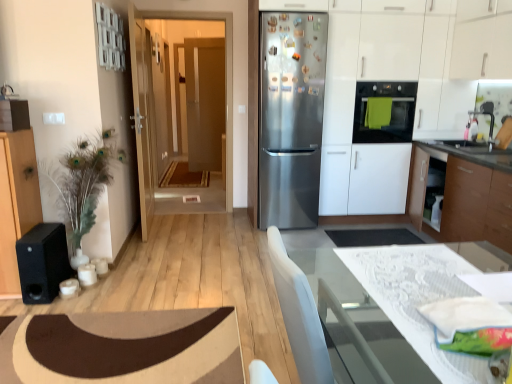
Identify the location of empty space that is in between wooden door at center, marked as the first door in a front-to-back arrangement, and satin white cabinet at right. This screenshot has width=512, height=384. (209, 223).